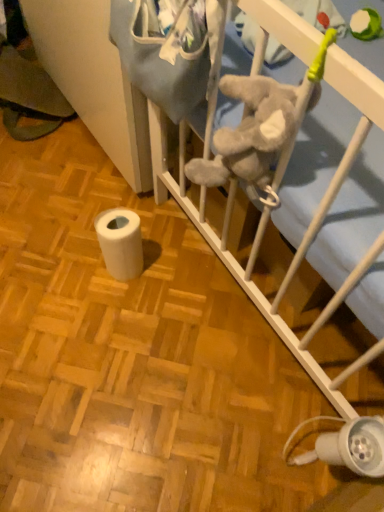
This screenshot has width=384, height=512. I want to click on free space in front of white matte toilet paper at lower left, so click(x=117, y=324).